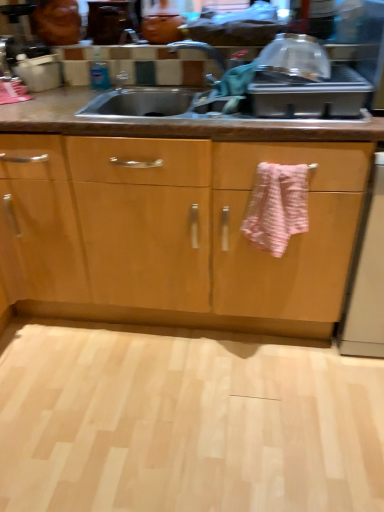
Locate an element on the screen. The width and height of the screenshot is (384, 512). vacant location below pink textured towel at center (from a real-world perspective) is located at coordinates (260, 354).